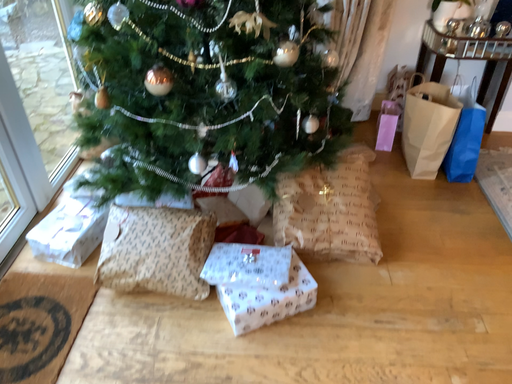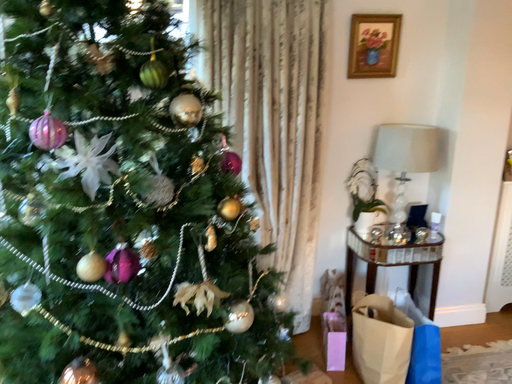
Question: How did the camera likely rotate when shooting the video?

Choices:
 (A) rotated downward
 (B) rotated upward

Answer: (B)